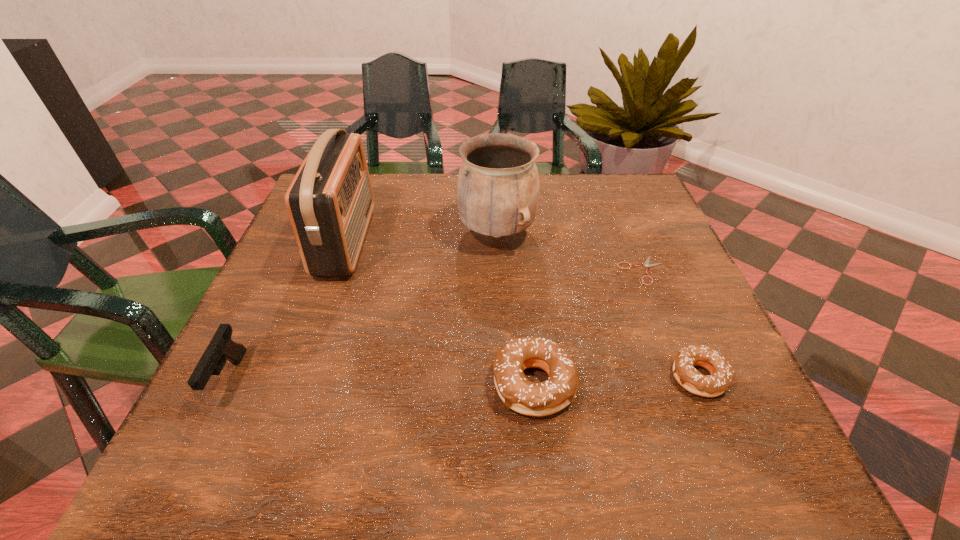
Find the location of `unoccupied position between the shorter doughnut and the third shortest object`. unoccupied position between the shorter doughnut and the third shortest object is located at coordinates (616, 380).

Locate an element on the screen. Image resolution: width=960 pixels, height=540 pixels. empty space that is in between the right doughnut and the urn is located at coordinates (598, 305).

Locate an element on the screen. free space that is in between the urn and the fifth tallest object is located at coordinates (598, 305).

This screenshot has height=540, width=960. Identify the location of empty location between the urn and the shortest object. (569, 252).

The height and width of the screenshot is (540, 960). I want to click on vacant space that's between the leftmost object and the fifth tallest object, so click(x=464, y=377).

The height and width of the screenshot is (540, 960). I want to click on vacant area that lies between the second shortest object and the pistol, so click(464, 377).

What are the coordinates of `free space between the fifth object from right to left and the leftmost object` in the screenshot? It's located at (288, 310).

Locate an element on the screen. This screenshot has height=540, width=960. vacant space that's between the urn and the radio receiver is located at coordinates (421, 237).

Locate which object ranks third in proximity to the left doughnut. Please provide its 2D coordinates. Your answer should be formatted as a tuple, i.e. [(x, y)], where the tuple contains the x and y coordinates of a point satisfying the conditions above.

[(498, 188)]

You are a GUI agent. You are given a task and a screenshot of the screen. Output one action in this format:
    pyautogui.click(x=<x>, y=<y>)
    Task: Click on the object that is the fourth nearest to the leftmost object
    The width and height of the screenshot is (960, 540).
    Given the screenshot: What is the action you would take?
    pyautogui.click(x=647, y=265)